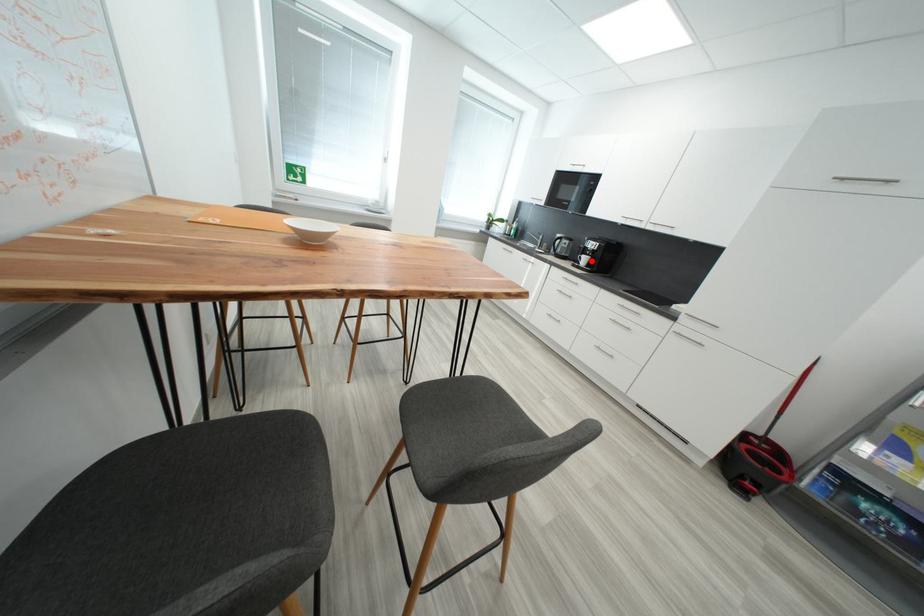
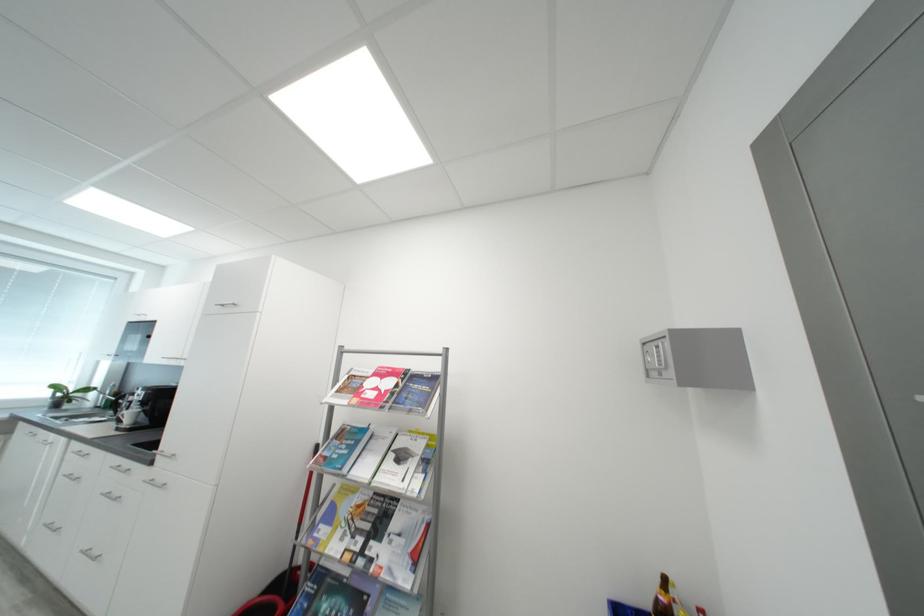
Find the pixel in the second image that matches the highlighted location in the first image.

(138, 416)